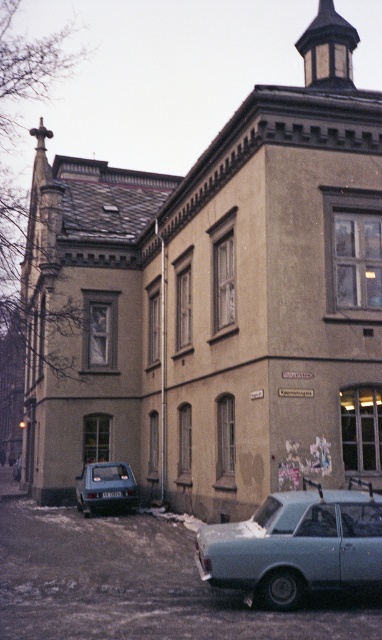
Question: Which of the following is the farthest from the observer?

Choices:
 (A) matte blue hatchback at lower left
 (B) light blue metallic car at lower right

Answer: (A)

Question: Among these points, which one is farthest from the camera?

Choices:
 (A) (356, 540)
 (B) (126, 467)

Answer: (B)

Question: Among these objects, which one is nearest to the camera?

Choices:
 (A) light blue metallic car at lower right
 (B) matte blue hatchback at lower left

Answer: (A)

Question: Is light blue metallic car at lower right closer to camera compared to matte blue hatchback at lower left?

Choices:
 (A) yes
 (B) no

Answer: (A)

Question: Is light blue metallic car at lower right above matte blue hatchback at lower left?

Choices:
 (A) yes
 (B) no

Answer: (A)

Question: Does light blue metallic car at lower right appear on the right side of matte blue hatchback at lower left?

Choices:
 (A) no
 (B) yes

Answer: (B)